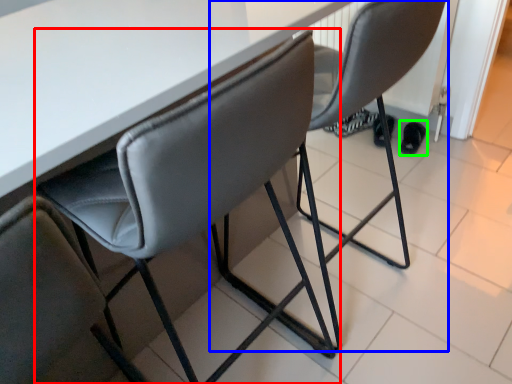
Question: Which is nearer to the chair (highlighted by a red box)? chair (highlighted by a blue box) or footwear (highlighted by a green box).

Choices:
 (A) chair
 (B) footwear

Answer: (A)